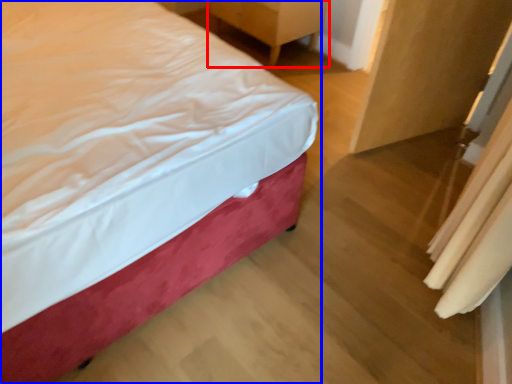
Question: Which point is closer to the camera, furniture (highlighted by a red box) or bed (highlighted by a blue box)?

Choices:
 (A) furniture
 (B) bed

Answer: (B)